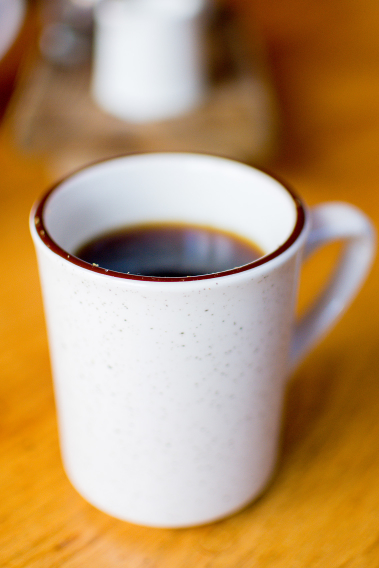
This screenshot has height=568, width=379. Find the location of `cup`. cup is located at coordinates (269, 438).